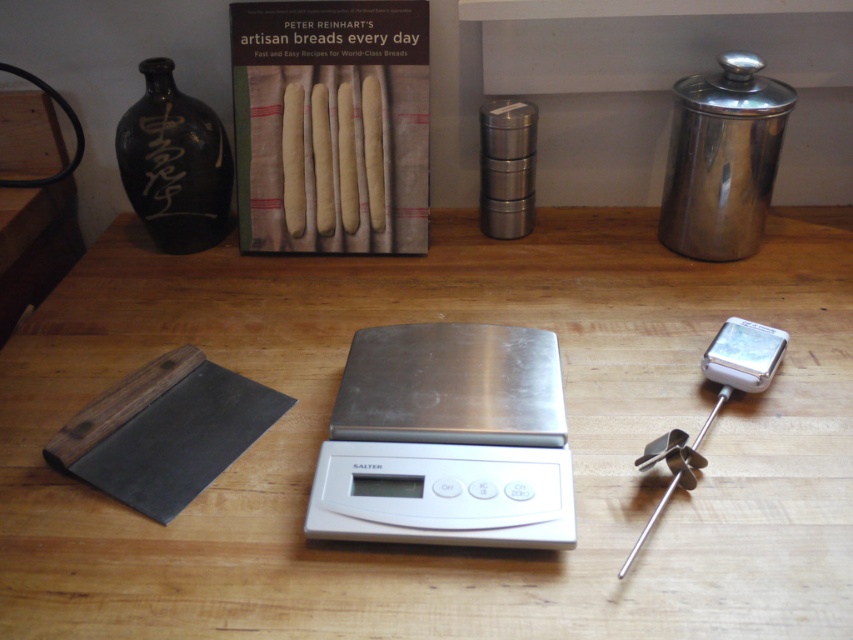
You are standing at the origin point of the coordinate system. You want to place a new item on the wooden table at center. What are the coordinates where you should place it?

The wooden table at center is located at coordinates point (x=450, y=547), so you should place the new item at those coordinates.